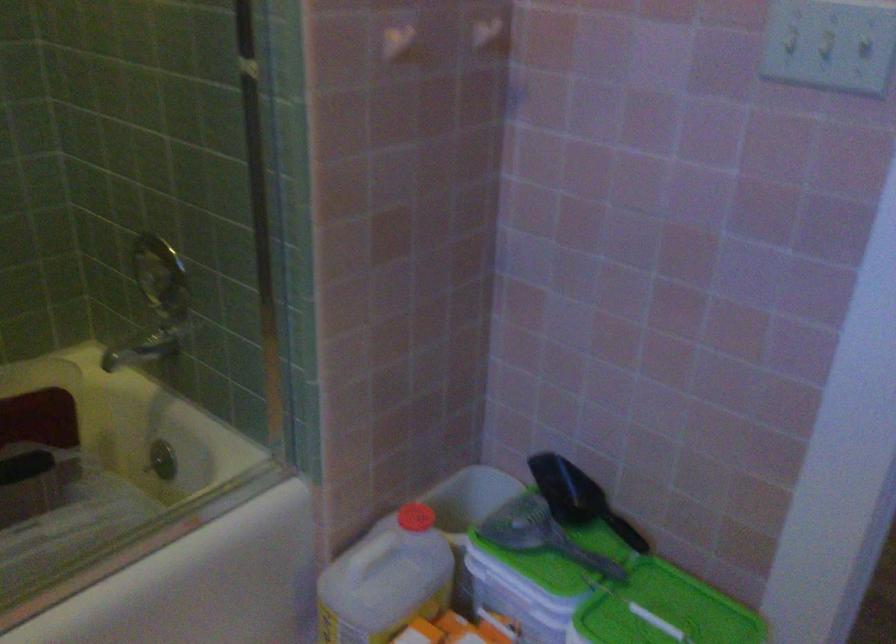
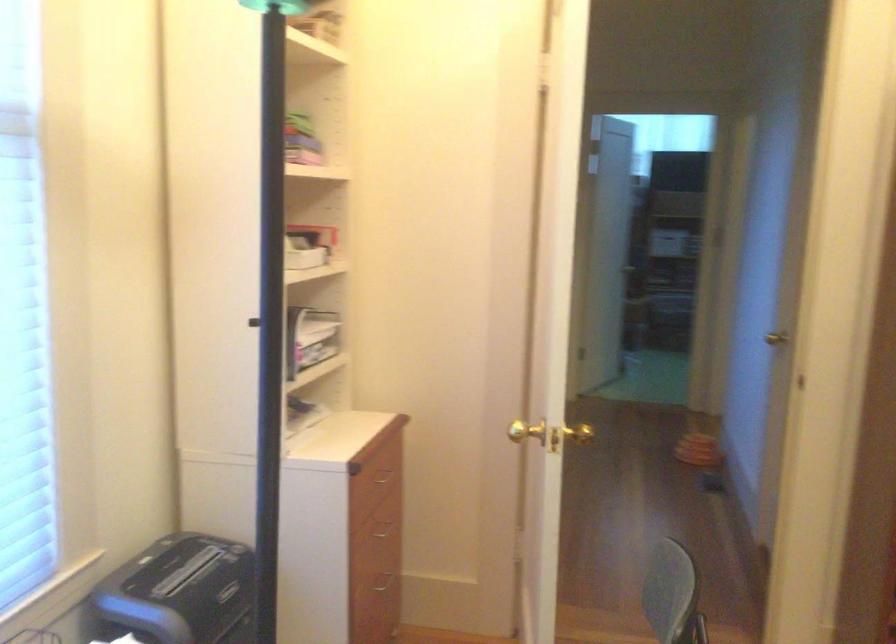
Question: I am providing you with two images of the same scene from different viewpoints. Which of the following objects are not visible in image2?

Choices:
 (A) light switch
 (B) drawer handle
 (C) folded metal chair
 (D) gold door knob

Answer: (A)